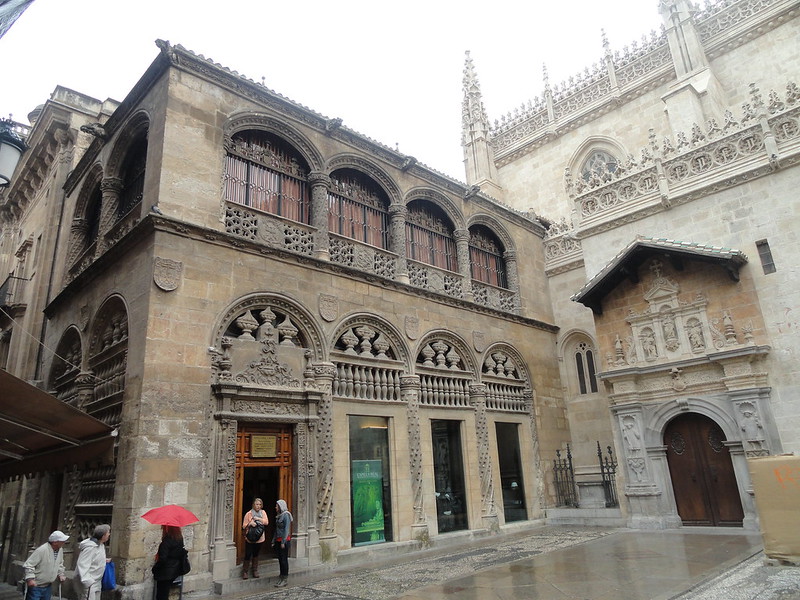
I want to click on window, so click(258, 206).